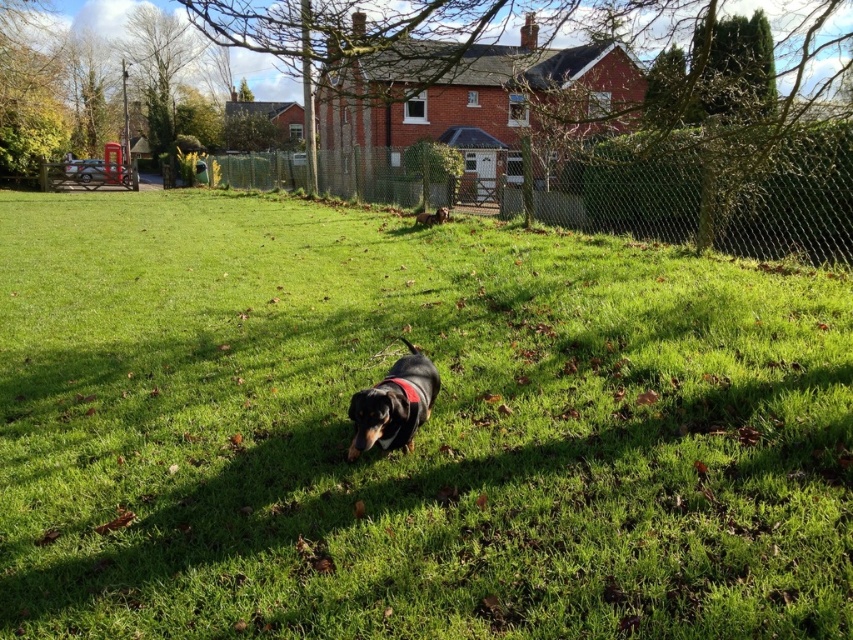
Who is higher up, green grassy at center or wire mesh fence at upper center?

wire mesh fence at upper center is above.

Is green grassy at center wider than wire mesh fence at upper center?

No.

At what (x,y) coordinates should I click in order to perform the action: click on green grassy at center. Please return your answer as a coordinate pair (x, y). Image resolution: width=853 pixels, height=640 pixels. Looking at the image, I should click on (416, 435).

The width and height of the screenshot is (853, 640). Identify the location of green grassy at center. (416, 435).

Can you confirm if black smooth dachshund at center is positioned to the left of black glossy dog at center?

Indeed, black smooth dachshund at center is positioned on the left side of black glossy dog at center.

Image resolution: width=853 pixels, height=640 pixels. Identify the location of black smooth dachshund at center. (393, 404).

Is point (364, 448) closer to viewer compared to point (434, 221)?

Yes, it is in front of point (434, 221).

Locate an element on the screen. The image size is (853, 640). black smooth dachshund at center is located at coordinates (393, 404).

Does point (38, 337) lie behind point (360, 445)?

Yes.

Between green grassy at center and black smooth dachshund at center, which one is positioned higher?

green grassy at center is higher up.

Where is `green grassy at center`? Image resolution: width=853 pixels, height=640 pixels. green grassy at center is located at coordinates (416, 435).